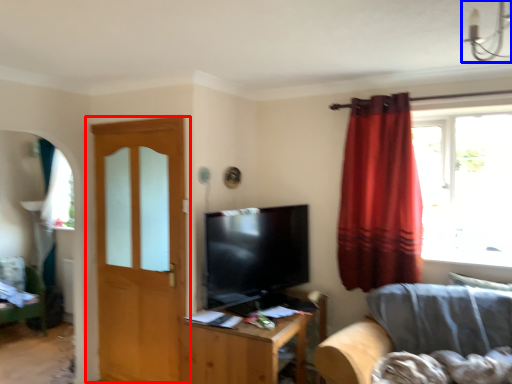
Question: Which point is further to the camera, door (highlighted by a red box) or light fixture (highlighted by a blue box)?

Choices:
 (A) door
 (B) light fixture

Answer: (A)